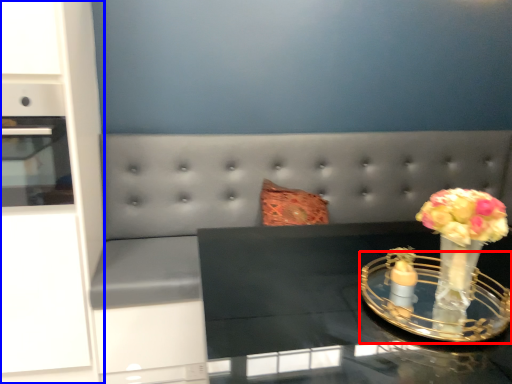
Question: Which of the following is the farthest to the observer, candle holder (highlighted by a red box) or dresser (highlighted by a blue box)?

Choices:
 (A) candle holder
 (B) dresser

Answer: (B)